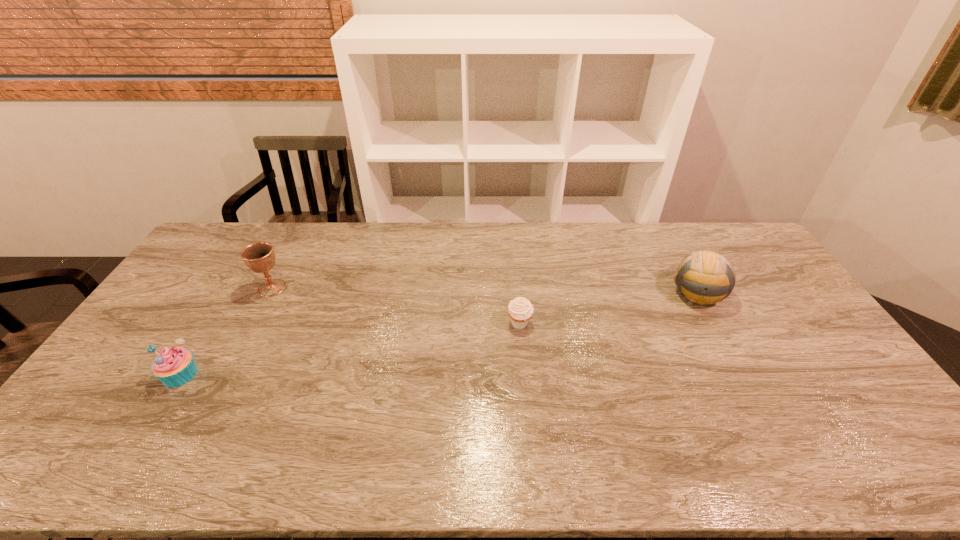
The height and width of the screenshot is (540, 960). Find the location of `the rightmost object`. the rightmost object is located at coordinates (704, 277).

Identify the location of the third object from right to left. This screenshot has height=540, width=960. (260, 257).

At what (x,y) coordinates should I click in order to perform the action: click on the nearest object. Please return your answer as a coordinate pair (x, y). This screenshot has width=960, height=540. Looking at the image, I should click on (174, 366).

The width and height of the screenshot is (960, 540). In order to click on the left muffin in this screenshot , I will do `click(174, 366)`.

At what (x,y) coordinates should I click in order to perform the action: click on the farther muffin. Please return your answer as a coordinate pair (x, y). This screenshot has width=960, height=540. Looking at the image, I should click on (520, 309).

Locate an element on the screen. The width and height of the screenshot is (960, 540). the right muffin is located at coordinates (520, 309).

The image size is (960, 540). Identify the location of free space located on the right of the volleyball. (759, 294).

You are a GUI agent. You are given a task and a screenshot of the screen. Output one action in this format:
    pyautogui.click(x=<x>, y=<y>)
    Task: Click on the free location located 0.090m on the front of the chalice
    This screenshot has height=540, width=960.
    Given the screenshot: What is the action you would take?
    pyautogui.click(x=256, y=318)

Where is `vacant space located 0.070m on the left of the left muffin`? This screenshot has height=540, width=960. vacant space located 0.070m on the left of the left muffin is located at coordinates click(136, 374).

The width and height of the screenshot is (960, 540). Identify the location of free region located 0.100m on the right of the second object from right to left. (564, 323).